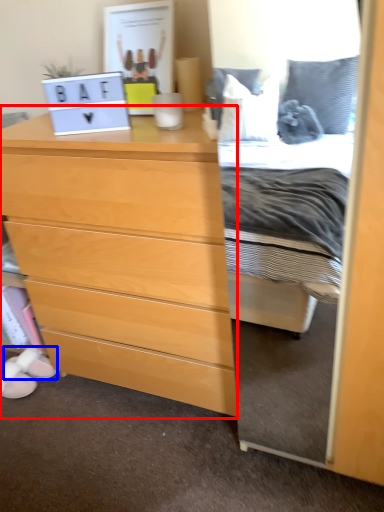
Question: Which object appears farthest to the camera in this image, chest of drawers (highlighted by a red box) or shoe (highlighted by a blue box)?

Choices:
 (A) chest of drawers
 (B) shoe

Answer: (B)